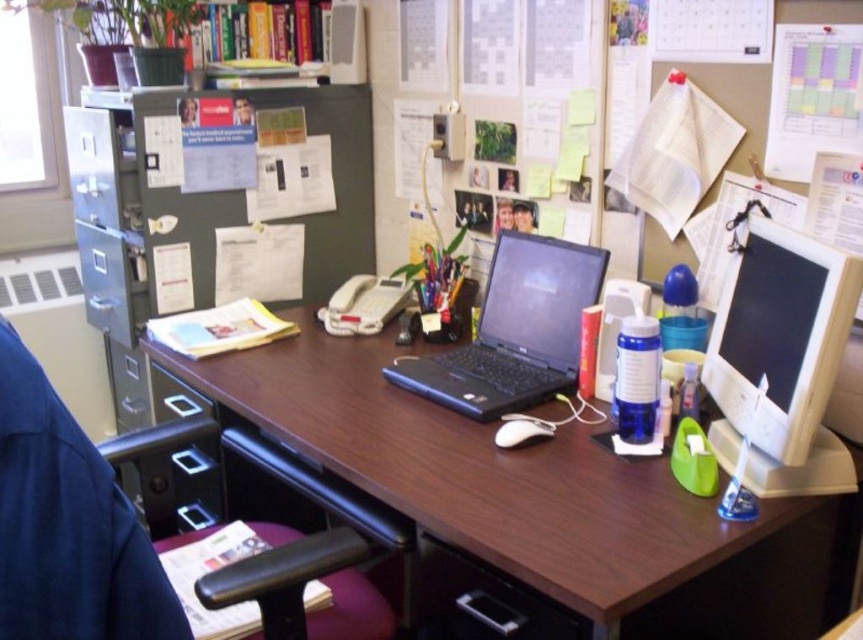
Can you confirm if dark blue fabric swivel chair at left is smaller than black plastic drawer at lower left?

Yes, dark blue fabric swivel chair at left is smaller than black plastic drawer at lower left.

Between dark blue fabric swivel chair at left and black plastic drawer at lower left, which one appears on the left side from the viewer's perspective?

From the viewer's perspective, black plastic drawer at lower left appears more on the left side.

The image size is (863, 640). Find the location of `dark blue fabric swivel chair at left`. dark blue fabric swivel chair at left is located at coordinates (68, 524).

Is metallic gray file cabinet at left shorter than black plastic drawer at lower left?

No, metallic gray file cabinet at left is not shorter than black plastic drawer at lower left.

Between metallic gray file cabinet at left and black plastic drawer at lower left, which one has more height?

Standing taller between the two is metallic gray file cabinet at left.

From the picture: Who is more distant from viewer, (110,218) or (194,484)?

Positioned behind is point (110,218).

This screenshot has height=640, width=863. Identify the location of metallic gray file cabinet at left. (206, 205).

Which is more to the left, black plastic laptop at center or black plastic drawer at lower left?

black plastic drawer at lower left

Between black plastic laptop at center and black plastic drawer at lower left, which one appears on the right side from the viewer's perspective?

Positioned to the right is black plastic laptop at center.

You are a GUI agent. You are given a task and a screenshot of the screen. Output one action in this format:
    pyautogui.click(x=<x>, y=<y>)
    Task: Click on the black plastic laptop at center
    The height and width of the screenshot is (640, 863).
    Given the screenshot: What is the action you would take?
    pyautogui.click(x=514, y=332)